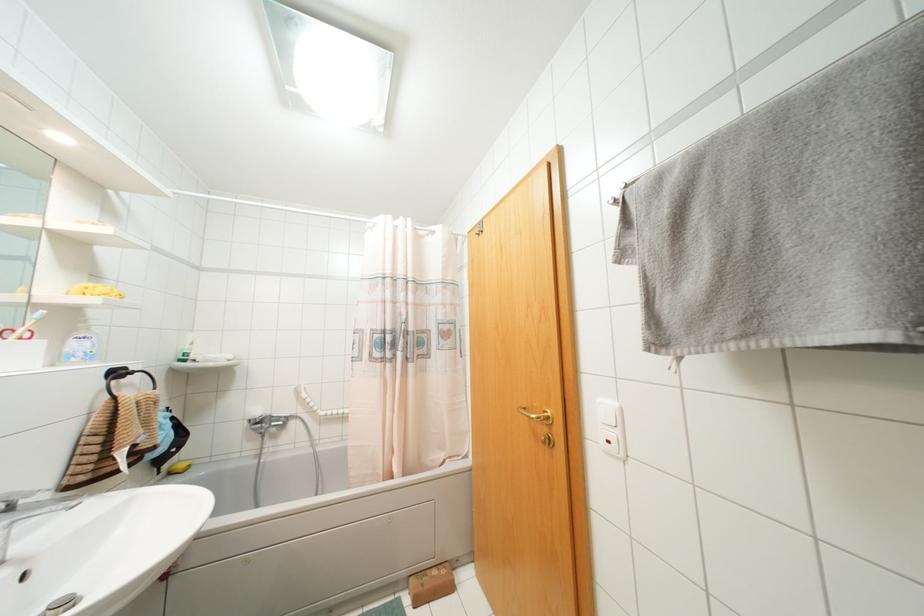
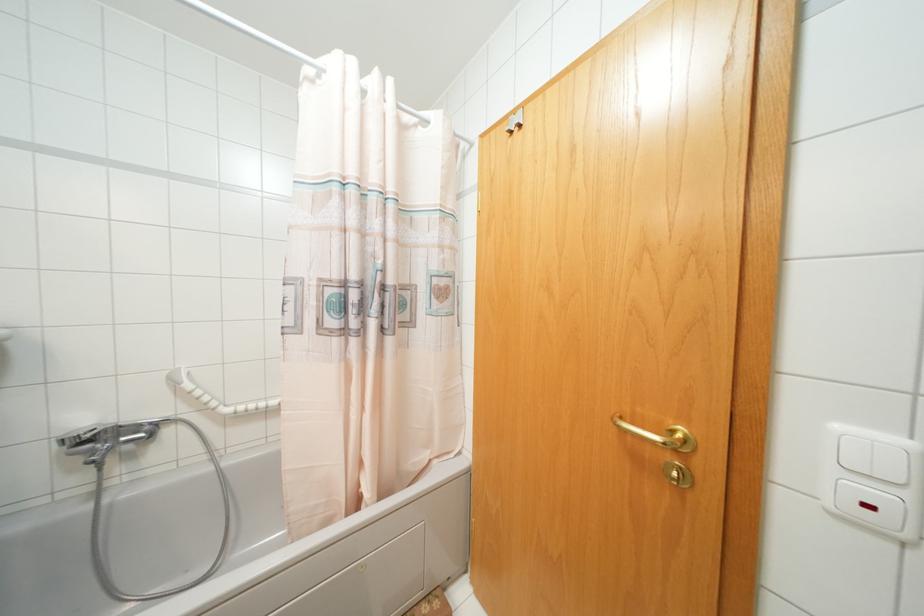
Locate, in the second image, the point that corresponds to the point at 258,421 in the first image.

(84, 440)